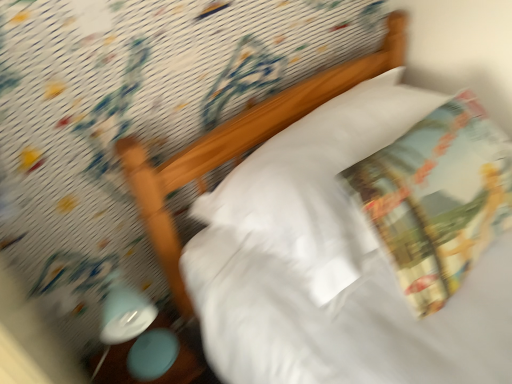
At what (x,y) coordinates should I click in order to perform the action: click on matte blue lamp at lower left. Please return your answer as a coordinate pair (x, y). The image size is (512, 384). Looking at the image, I should click on pyautogui.click(x=136, y=330).

Find the location of `white soft pillow at upper center`. white soft pillow at upper center is located at coordinates (316, 184).

In order to click on printed fabric throw pillow at upper right in this screenshot , I will do `click(437, 198)`.

Identify the location of matte plastic table at lower left. The image size is (512, 384). (157, 378).

This screenshot has height=384, width=512. What are the coordinates of `matte blue lamp at lower left` in the screenshot? It's located at (136, 330).

Is matte plastic table at lower left positioned with its back to white soft pillow at upper center?

matte plastic table at lower left is not turned away from white soft pillow at upper center.

Which point is more distant from viewer, (178, 374) or (272, 190)?

The point (178, 374) is farther from the camera.

Measure the distance from matte plastic table at lower left to white soft pillow at upper center.

matte plastic table at lower left is 22.17 inches away from white soft pillow at upper center.

From a real-world perspective, is matte plastic table at lower left positioned above or below white soft pillow at upper center?

Clearly, from a real-world perspective, matte plastic table at lower left is below white soft pillow at upper center.

Between matte blue lamp at lower left and printed fabric throw pillow at upper right, which one is positioned behind?

matte blue lamp at lower left is further away from the camera.

Is matte blue lamp at lower left to the left of printed fabric throw pillow at upper right from the viewer's perspective?

Correct, you'll find matte blue lamp at lower left to the left of printed fabric throw pillow at upper right.

Based on the photo, how distant is matte blue lamp at lower left from printed fabric throw pillow at upper right?

matte blue lamp at lower left is 29.35 inches away from printed fabric throw pillow at upper right.

Does matte blue lamp at lower left have a larger size compared to printed fabric throw pillow at upper right?

Incorrect, matte blue lamp at lower left is not larger than printed fabric throw pillow at upper right.

From a real-world perspective, which is physically above, matte plastic table at lower left or printed fabric throw pillow at upper right?

printed fabric throw pillow at upper right, from a real-world perspective.

Can you confirm if matte plastic table at lower left is wider than printed fabric throw pillow at upper right?

Incorrect, the width of matte plastic table at lower left does not surpass that of printed fabric throw pillow at upper right.

Considering the sizes of objects matte plastic table at lower left and printed fabric throw pillow at upper right in the image provided, who is smaller, matte plastic table at lower left or printed fabric throw pillow at upper right?

matte plastic table at lower left.

Considering the positions of objects matte blue lamp at lower left and white soft pillow at upper center in the image provided, who is more to the left, matte blue lamp at lower left or white soft pillow at upper center?

From the viewer's perspective, matte blue lamp at lower left appears more on the left side.

From the image's perspective, would you say matte blue lamp at lower left is shown under white soft pillow at upper center?

Yes.

Can you confirm if matte blue lamp at lower left is thinner than white soft pillow at upper center?

Indeed, matte blue lamp at lower left has a lesser width compared to white soft pillow at upper center.

Do you think matte blue lamp at lower left is within white soft pillow at upper center, or outside of it?

matte blue lamp at lower left lies outside white soft pillow at upper center.

From the picture: From the image's perspective, is white soft pillow at upper center under printed fabric throw pillow at upper right?

No, from the image's perspective, white soft pillow at upper center is not below printed fabric throw pillow at upper right.

From a real-world perspective, between white soft pillow at upper center and printed fabric throw pillow at upper right, who is vertically lower?

In real-world perspective, white soft pillow at upper center is lower.

Would you say white soft pillow at upper center is inside or outside printed fabric throw pillow at upper right?

The correct answer is: inside.

Is white soft pillow at upper center facing towards printed fabric throw pillow at upper right?

Yes, white soft pillow at upper center is oriented towards printed fabric throw pillow at upper right.

In the image, there is a matte blue lamp at lower left. Where is `pillow above it (from the image's perspective)`? The image size is (512, 384). pillow above it (from the image's perspective) is located at coordinates (316, 184).

Is white soft pillow at upper center looking in the opposite direction of matte blue lamp at lower left?

No, white soft pillow at upper center is not facing away from matte blue lamp at lower left.

From the image's perspective, is white soft pillow at upper center below matte blue lamp at lower left?

No.

Between point (225, 183) and point (145, 325), which one is positioned behind?

The point (225, 183) is more distant.

Which of these two, printed fabric throw pillow at upper right or matte blue lamp at lower left, stands taller?

Standing taller between the two is matte blue lamp at lower left.

Considering the sizes of objects printed fabric throw pillow at upper right and matte blue lamp at lower left in the image provided, who is wider, printed fabric throw pillow at upper right or matte blue lamp at lower left?

printed fabric throw pillow at upper right is wider.

Find the location of a particular element. This screenshot has width=512, height=384. pillow above the matte plastic table at lower left (from the image's perspective) is located at coordinates (316, 184).

Where is `throw pillow in front of the matte blue lamp at lower left`? The height and width of the screenshot is (384, 512). throw pillow in front of the matte blue lamp at lower left is located at coordinates (437, 198).

Based on their spatial positions, is matte blue lamp at lower left or white soft pillow at upper center closer to printed fabric throw pillow at upper right?

white soft pillow at upper center is closer to printed fabric throw pillow at upper right.

Which object lies nearer to the anchor point matte plastic table at lower left, white soft pillow at upper center or matte blue lamp at lower left?

The object closer to matte plastic table at lower left is matte blue lamp at lower left.

Looking at the image, which one is located further to matte plastic table at lower left, printed fabric throw pillow at upper right or matte blue lamp at lower left?

The object further to matte plastic table at lower left is printed fabric throw pillow at upper right.

When comparing their distances from white soft pillow at upper center, does matte blue lamp at lower left or matte plastic table at lower left seem closer?

matte blue lamp at lower left.

Which object lies nearer to the anchor point white soft pillow at upper center, matte plastic table at lower left or matte blue lamp at lower left?

The object closer to white soft pillow at upper center is matte blue lamp at lower left.

Considering their positions, is printed fabric throw pillow at upper right positioned closer to matte plastic table at lower left than white soft pillow at upper center?

Based on the image, white soft pillow at upper center appears to be nearer to matte plastic table at lower left.

From the image, which object appears to be nearer to white soft pillow at upper center, printed fabric throw pillow at upper right or matte blue lamp at lower left?

printed fabric throw pillow at upper right.

Which object lies further to the anchor point matte blue lamp at lower left, printed fabric throw pillow at upper right or matte plastic table at lower left?

printed fabric throw pillow at upper right.

Locate an element on the screen. The image size is (512, 384). lamp between white soft pillow at upper center and matte plastic table at lower left vertically is located at coordinates (136, 330).

Find the location of a particular element. This screenshot has width=512, height=384. table situated between matte blue lamp at lower left and printed fabric throw pillow at upper right from left to right is located at coordinates (157, 378).

Find the location of a particular element. pillow between matte blue lamp at lower left and printed fabric throw pillow at upper right is located at coordinates (316, 184).

You are a GUI agent. You are given a task and a screenshot of the screen. Output one action in this format:
    pyautogui.click(x=<x>, y=<y>)
    Task: Click on the pillow between matte plastic table at lower left and printed fabric throw pillow at upper right
    This screenshot has width=512, height=384.
    Given the screenshot: What is the action you would take?
    pyautogui.click(x=316, y=184)